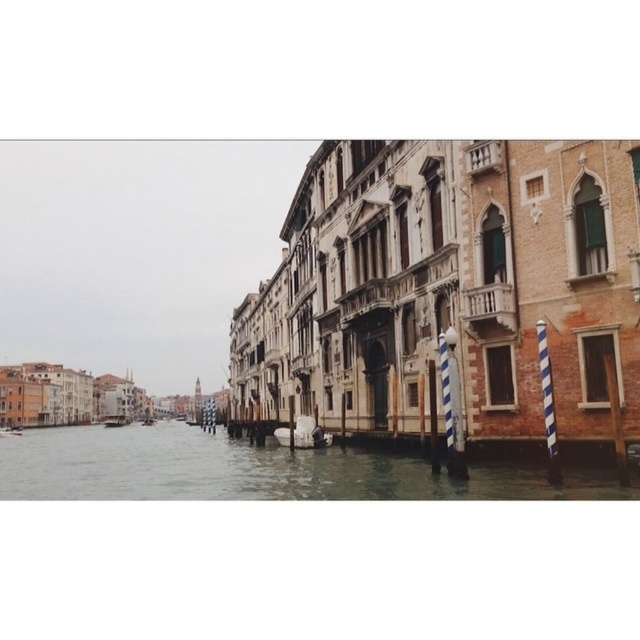
Question: Which object is farther from the camera taking this photo?

Choices:
 (A) white glossy boat at center
 (B) clear water at center
 (C) wooden boat at center

Answer: (C)

Question: Is clear water at center positioned behind white glossy boat at center?

Choices:
 (A) no
 (B) yes

Answer: (A)

Question: Which point is closer to the camera?

Choices:
 (A) wooden boat at center
 (B) white glossy boat at center
 (C) clear water at center

Answer: (C)

Question: Observing the image, what is the correct spatial positioning of clear water at center in reference to white glossy boat at center?

Choices:
 (A) right
 (B) left

Answer: (B)

Question: Which point is farther to the camera?

Choices:
 (A) (310, 417)
 (B) (109, 426)
 (C) (54, 490)

Answer: (B)

Question: Is clear water at center below white glossy boat at center?

Choices:
 (A) yes
 (B) no

Answer: (A)